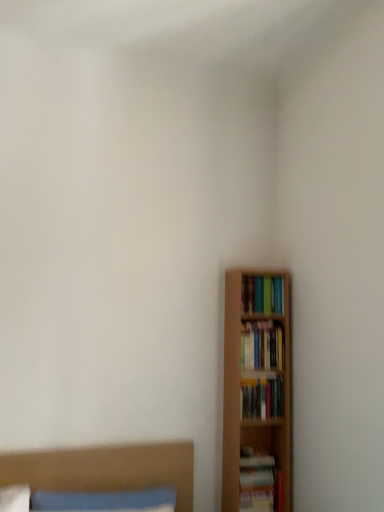
Find the location of `free space above matte green book at right, the fourth book when ordered from bottom to top (from a real-world perspective)`. free space above matte green book at right, the fourth book when ordered from bottom to top (from a real-world perspective) is located at coordinates (265, 276).